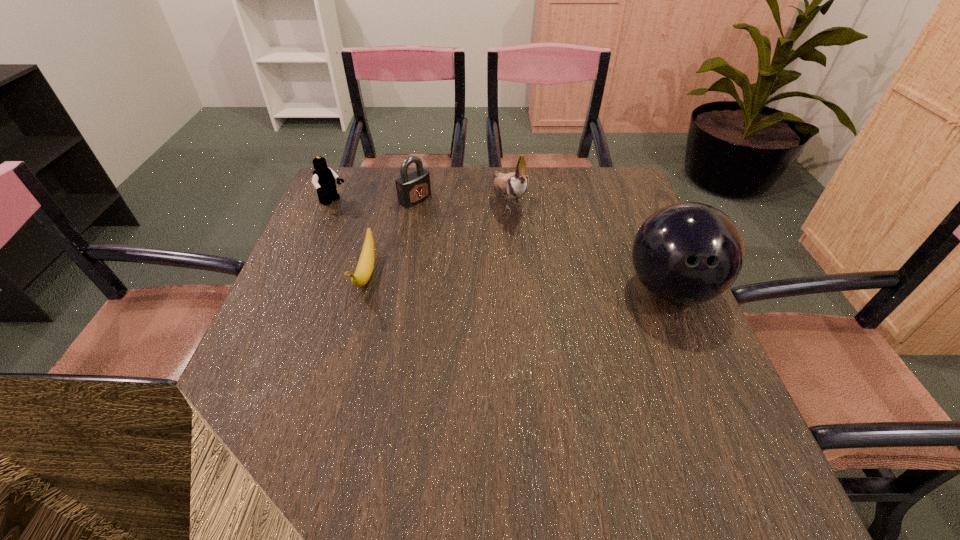
You are a GUI agent. You are given a task and a screenshot of the screen. Output one action in this format:
    pyautogui.click(x=<x>, y=<y>)
    Task: Click on the vacant spot on the desktop that is between the banana and the rightmost object and is positioned on the front-facing side of the leftmost object
    
    Given the screenshot: What is the action you would take?
    pyautogui.click(x=487, y=281)

You are a GUI agent. You are given a task and a screenshot of the screen. Output one action in this format:
    pyautogui.click(x=<x>, y=<y>)
    Task: Click on the vacant space on the desktop that is between the banana and the rightmost object and is positioned at the face of the bird
    
    Given the screenshot: What is the action you would take?
    pyautogui.click(x=556, y=284)

Identify the location of free spot on the desktop that is between the shortest object and the rightmost object and is positioned on the front of the third object from left to right near the keyhole. (545, 284).